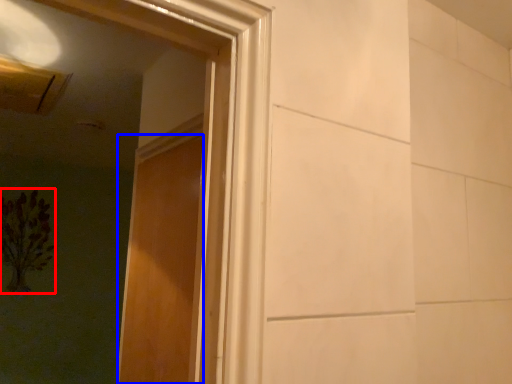
Question: Which object appears closest to the camera in this image, flower (highlighted by a red box) or door (highlighted by a blue box)?

Choices:
 (A) flower
 (B) door

Answer: (B)